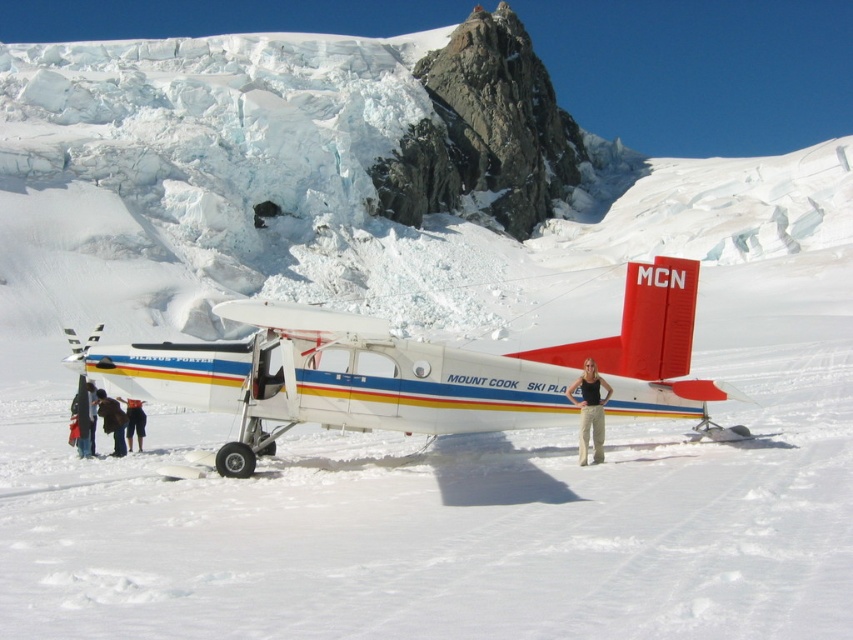
From the picture: You are a photographer standing in front of the MOUNT COOK SKI PLANE. You notice two items at the lower left corner of your viewfinder. One is dark blue jeans at lower left and the other is dark blue jacket at lower left. Which item appears taller in the photo?

The dark blue jacket at lower left appears taller than the dark blue jeans at lower left because the jeans are not as tall as the jacket.

You are a photographer trying to capture a photo of the dark blue jeans at lower left and dark blue jacket at lower left. Which one should you zoom in on to ensure the subject fills the frame better?

The dark blue jeans at lower left has a smaller size compared to the dark blue jacket at lower left, so you should zoom in on the dark blue jacket at lower left to ensure it fills the frame better.

You are a drone operator trying to capture an aerial shot of the white matte airplane at center. The drone is currently hovering at point 0.5, 0.5. To get the best shot, you need to adjust the drone to the exact coordinates of the airplane. What direction should you move the drone to reach the airplane?

The white matte airplane at center is located at point (413,371). Since the drone is at (426,320), you should move the drone slightly to the right and down to reach the airplane.